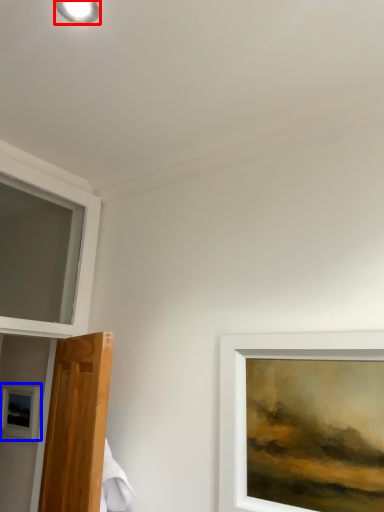
Question: Which of the following is the farthest to the observer, droplight (highlighted by a red box) or picture frame (highlighted by a blue box)?

Choices:
 (A) droplight
 (B) picture frame

Answer: (B)